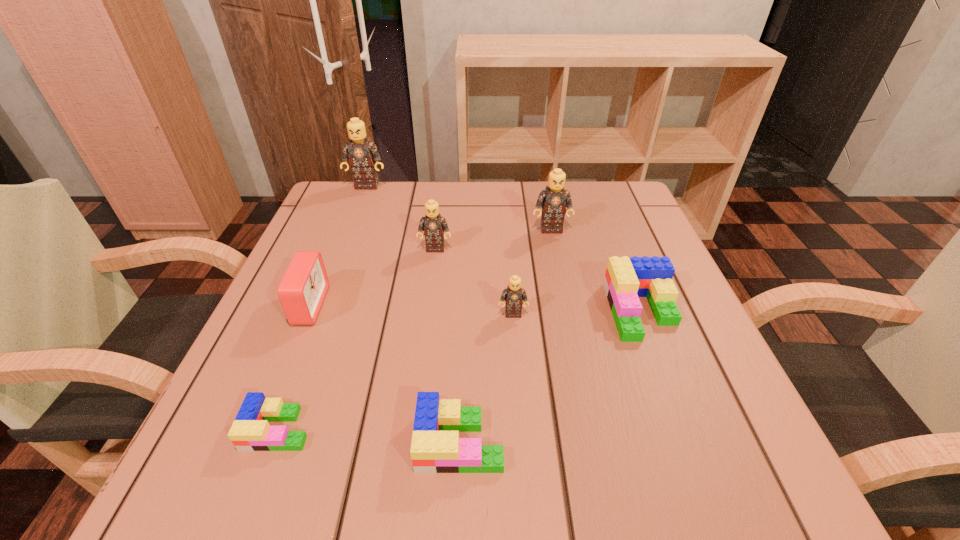
Point out which green Lego is positioned as the nearest to the tallest object. Please provide its 2D coordinates. Your answer should be formatted as a tuple, i.e. [(x, y)], where the tuple contains the x and y coordinates of a point satisfying the conditions above.

[(626, 279)]

The image size is (960, 540). I want to click on the closest green Lego to the third shortest object, so click(436, 447).

At what (x,y) coordinates should I click in order to perform the action: click on blank space that satisfies the following two spatial constraints: 1. on the front-facing side of the smallest green Lego; 2. on the right side of the alarm clock. Please return your answer as a coordinate pair (x, y). Image resolution: width=960 pixels, height=540 pixels. Looking at the image, I should click on (257, 429).

Identify the location of free location that satisfies the following two spatial constraints: 1. in front of the third farthest object; 2. on the left side of the rightmost green Lego. The image size is (960, 540). (427, 311).

I want to click on vacant space that satisfies the following two spatial constraints: 1. in front of the rightmost Lego; 2. on the right side of the second biggest tan Lego, so click(x=568, y=311).

Where is `vacant area in the image that satisfies the following two spatial constraints: 1. on the back side of the leftmost green Lego; 2. on the right side of the farthest green Lego`? vacant area in the image that satisfies the following two spatial constraints: 1. on the back side of the leftmost green Lego; 2. on the right side of the farthest green Lego is located at coordinates (323, 311).

You are a GUI agent. You are given a task and a screenshot of the screen. Output one action in this format:
    pyautogui.click(x=<x>, y=<y>)
    Task: Click on the free space that satisfies the following two spatial constraints: 1. on the front-facing side of the red alarm clock; 2. on the back side of the second smallest green Lego
    This screenshot has height=540, width=960.
    Given the screenshot: What is the action you would take?
    pyautogui.click(x=252, y=442)

This screenshot has width=960, height=540. Identify the location of vacant region that satisfies the following two spatial constraints: 1. in front of the shortest object; 2. on the right side of the biggest tan Lego. (273, 429).